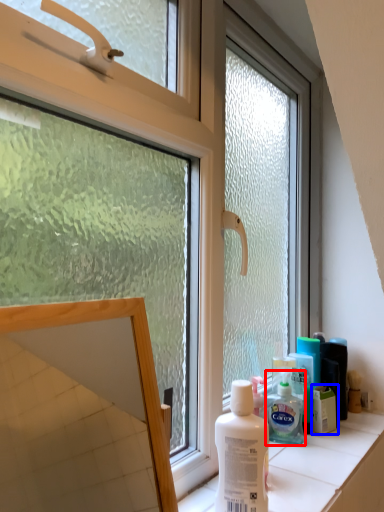
Question: Which of the following is the closest to the observer, shaving cream (highlighted by a red box) or product (highlighted by a blue box)?

Choices:
 (A) shaving cream
 (B) product

Answer: (A)